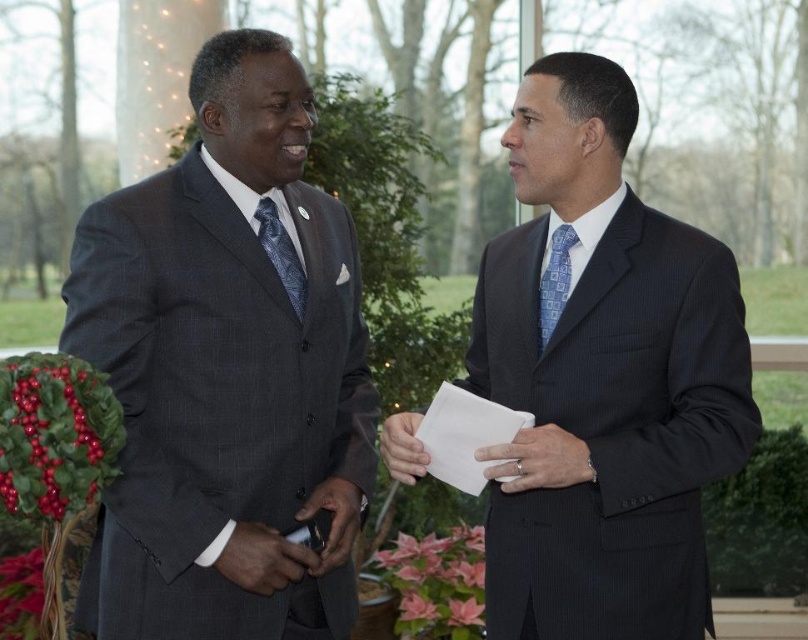
Find the location of a particular element. dark pinstripe suit at center is located at coordinates (606, 378).

Between point (482, 387) and point (548, 339), which one is positioned in front?

Positioned in front is point (548, 339).

Is point (638, 216) farther from viewer compared to point (541, 326)?

No.

Image resolution: width=808 pixels, height=640 pixels. I want to click on dark pinstripe suit at center, so click(x=606, y=378).

Can you confirm if blue textured tie at right is positioned below white paper at center?

No, blue textured tie at right is not below white paper at center.

Which is more to the right, blue textured tie at right or white paper at center?

From the viewer's perspective, blue textured tie at right appears more on the right side.

Does point (541, 326) come behind point (379, 442)?

No.

Locate an element on the screen. The height and width of the screenshot is (640, 808). blue textured tie at right is located at coordinates (554, 282).

Is matte black suit at center bigger than matte black phone at center?

No.

Which is in front, point (283, 563) or point (341, 497)?

Point (283, 563) is more forward.

The width and height of the screenshot is (808, 640). What are the coordinates of `matte black suit at center` in the screenshot? It's located at (263, 560).